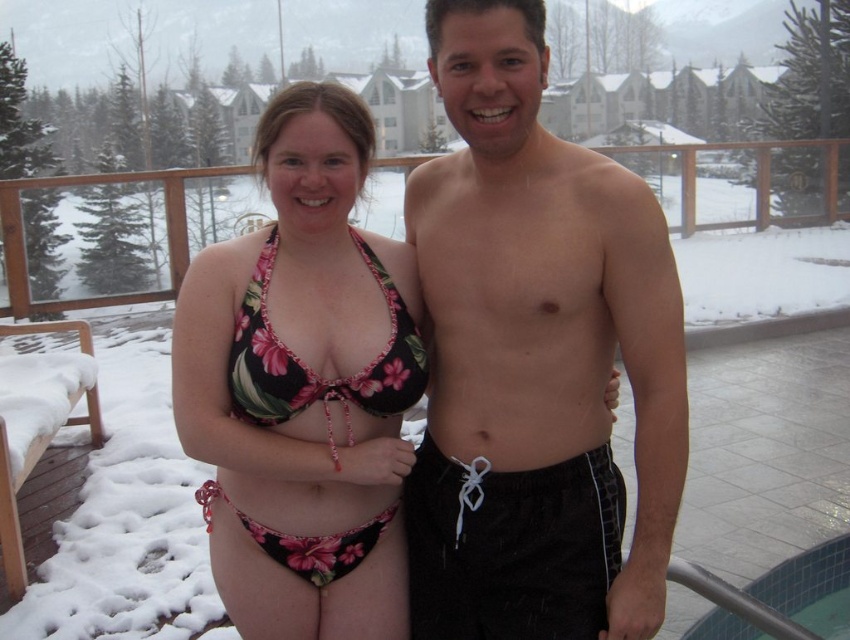
Is point (479, 588) in front of point (598, 264)?

No, it is behind (598, 264).

Identify the location of black fabric shorts at center. (536, 358).

Between black fabric at center and black fabric shorts at right, which one appears on the right side from the viewer's perspective?

Positioned to the right is black fabric at center.

Is black fabric at center smaller than black fabric shorts at right?

No.

This screenshot has width=850, height=640. I want to click on black fabric at center, so 513,305.

Does black fabric shorts at center lie in front of blue tile pool at lower right?

Yes, it is in front of blue tile pool at lower right.

Is the position of black fabric shorts at center more distant than that of blue tile pool at lower right?

No.

Does point (646, 253) come behind point (833, 634)?

No, it is in front of (833, 634).

Where is `black fabric shorts at center`? This screenshot has width=850, height=640. black fabric shorts at center is located at coordinates (536, 358).